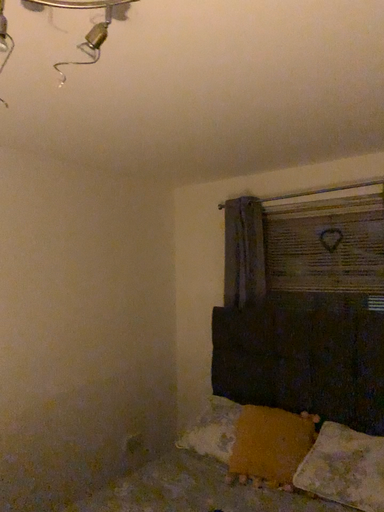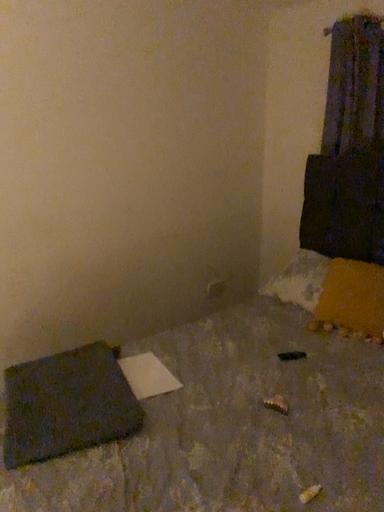
Question: Which way did the camera rotate in the video?

Choices:
 (A) rotated left
 (B) rotated right

Answer: (A)